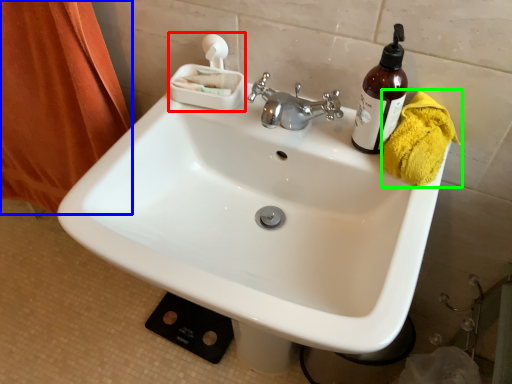
Question: Which object is the farthest from tissue (highlighted by a red box)? Choose among these: shower curtain (highlighted by a blue box) or bath towel (highlighted by a green box).

Choices:
 (A) shower curtain
 (B) bath towel

Answer: (A)